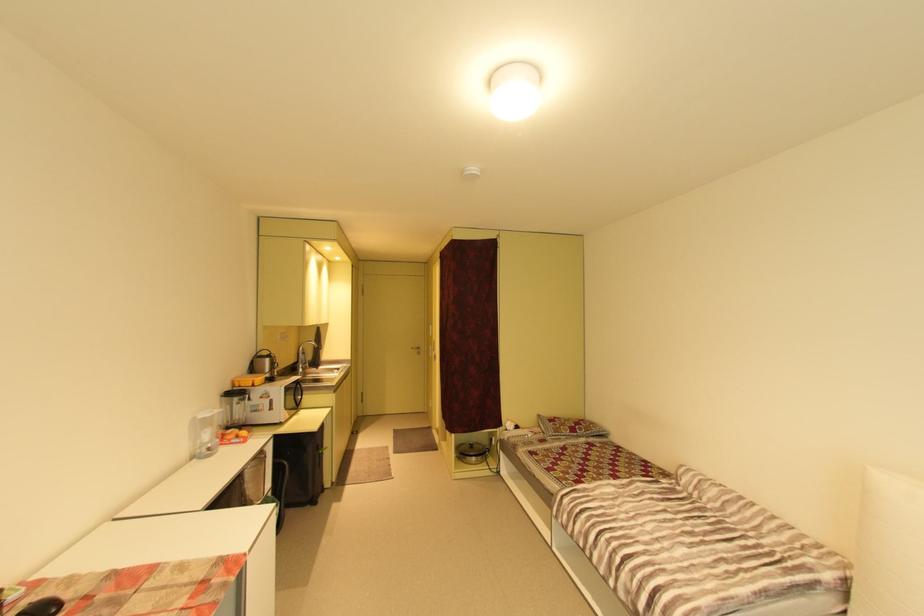
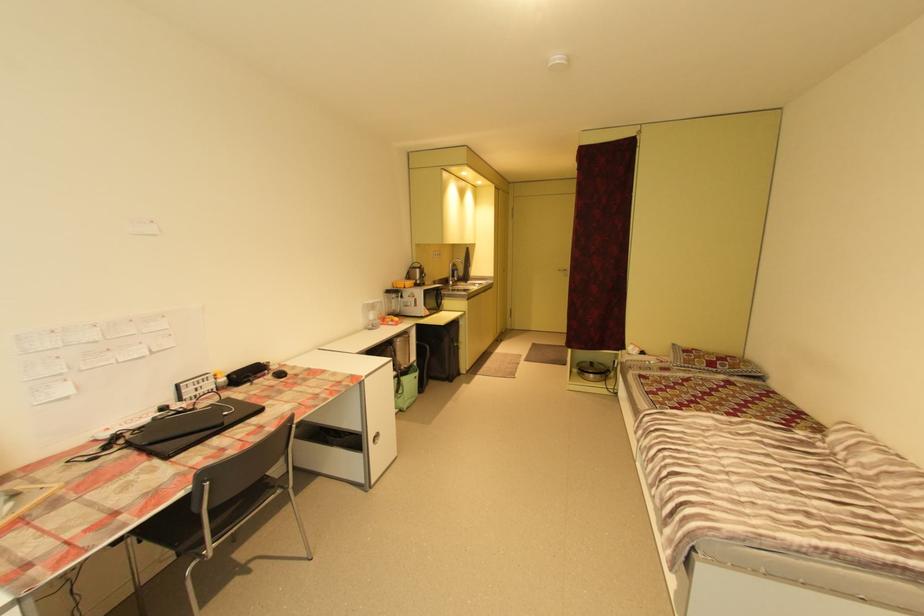
Question: The camera is either moving clockwise (left) or counter-clockwise (right) around the object. The first image is from the beginning of the video and the second image is from the end. Is the camera moving left or right when shooting the video?

Choices:
 (A) Left
 (B) Right

Answer: (B)